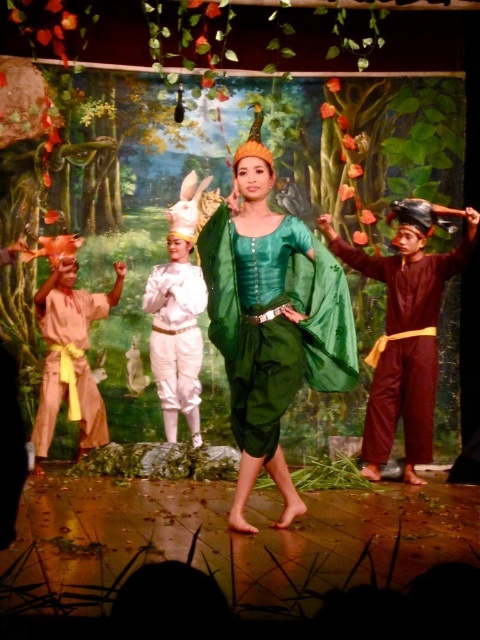
Between point (320, 388) and point (151, 305), which one is positioned in front?

Point (320, 388) is in front.

Does green silk dress at center lie behind white satin pants at center?

No.

Between point (240, 484) and point (155, 284), which one is positioned behind?

Point (155, 284)

The height and width of the screenshot is (640, 480). I want to click on green silk dress at center, so click(x=271, y=320).

What do you see at coordinates (271, 320) in the screenshot?
I see `green silk dress at center` at bounding box center [271, 320].

In the scene shown: Is green silk dress at center smaller than brown matte pants at right?

No.

Does point (295, 390) come closer to viewer compared to point (420, 358)?

That is True.

You are a GUI agent. You are given a task and a screenshot of the screen. Output one action in this format:
    pyautogui.click(x=<x>, y=<y>)
    Task: Click on the green silk dress at center
    The height and width of the screenshot is (640, 480).
    Given the screenshot: What is the action you would take?
    pyautogui.click(x=271, y=320)

Does point (257, 403) come in front of point (55, 420)?

Yes, it is.

Is point (283, 509) farther from viewer compared to point (51, 321)?

That is False.

Is point (230, 269) farther from camera compared to point (104, 436)?

No, it is in front of (104, 436).

Where is `green silk dress at center`? This screenshot has width=480, height=640. green silk dress at center is located at coordinates (271, 320).